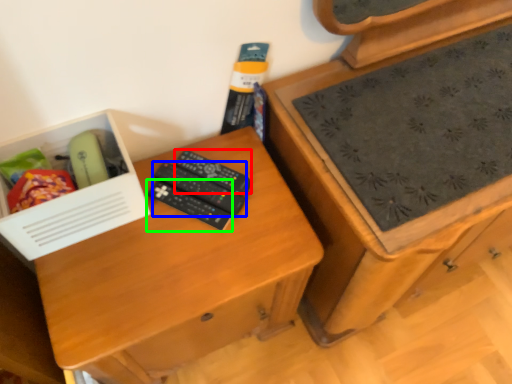
Question: Based on their relative distances, which object is farther from remote control (highlighted by a red box)? Choose from remote control (highlighted by a blue box) and remote control (highlighted by a green box).

Choices:
 (A) remote control
 (B) remote control

Answer: (B)